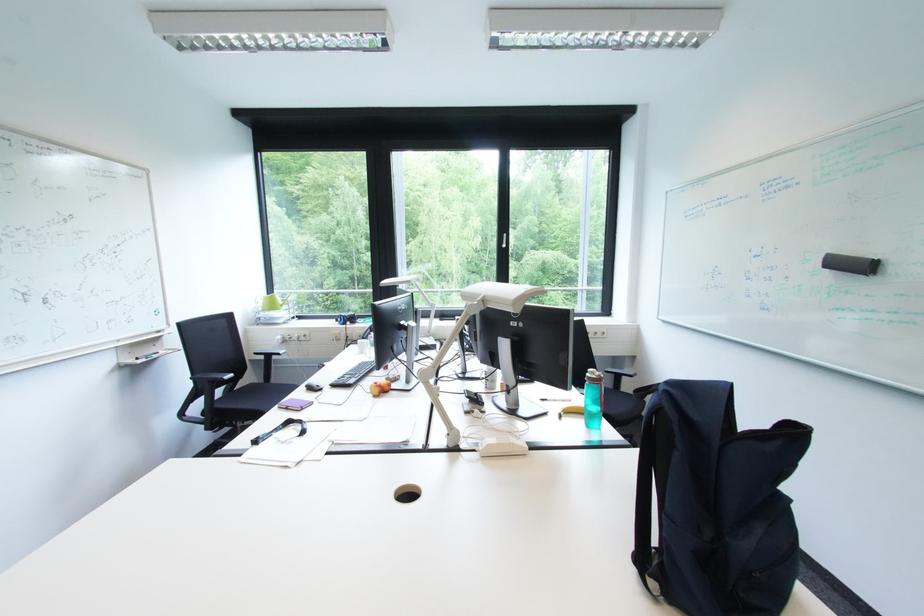
Where would you lift the yellow banana? Please return your answer as a coordinate pair (x, y).

(572, 410)